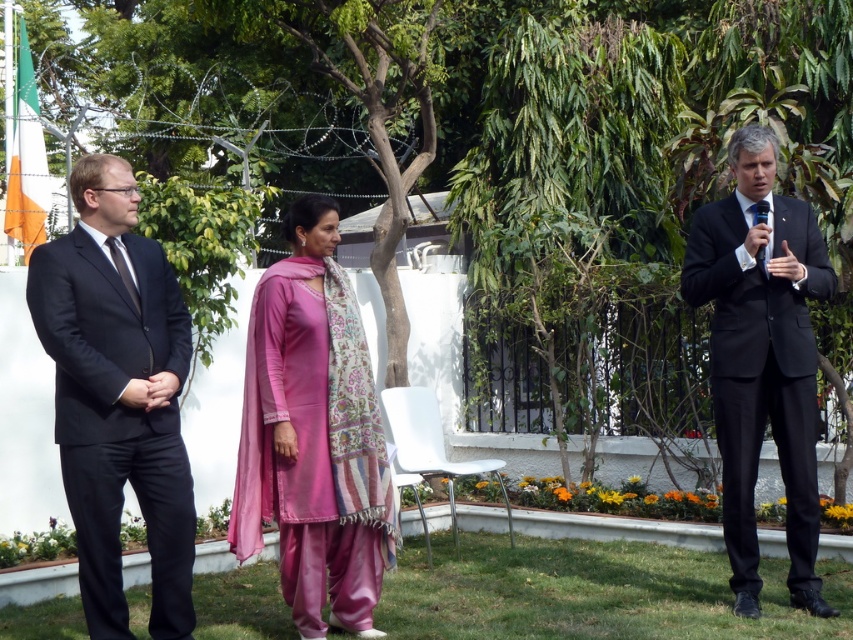
Between pink satin kurta at center and matte black suit at right, which one appears on the left side from the viewer's perspective?

From the viewer's perspective, pink satin kurta at center appears more on the left side.

Can you confirm if pink satin kurta at center is shorter than matte black suit at right?

Indeed, pink satin kurta at center has a lesser height compared to matte black suit at right.

Measure the distance between pink satin kurta at center and camera.

The distance of pink satin kurta at center from camera is 21.76 feet.

Locate an element on the screen. Image resolution: width=853 pixels, height=640 pixels. pink satin kurta at center is located at coordinates (312, 435).

Which is above, matte black suit at left or pink satin kurta at center?

matte black suit at left

Can you confirm if matte black suit at left is positioned to the right of pink satin kurta at center?

No, matte black suit at left is not to the right of pink satin kurta at center.

Measure the distance between matte black suit at left and camera.

matte black suit at left and camera are 5.87 meters apart from each other.

Locate an element on the screen. The height and width of the screenshot is (640, 853). matte black suit at left is located at coordinates (119, 396).

Can you confirm if matte black suit at left is wider than matte black suit at right?

No.

Is matte black suit at left positioned before matte black suit at right?

That is True.

Measure the distance between matte black suit at left and camera.

matte black suit at left is 5.87 meters from camera.

Find the location of a particular element. matte black suit at left is located at coordinates (119, 396).